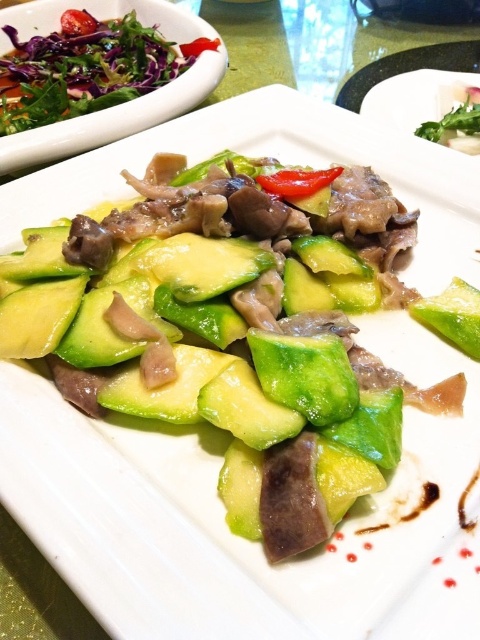
You are a GUI agent. You are given a task and a screenshot of the screen. Output one action in this format:
    pyautogui.click(x=<x>, y=<y>)
    Task: Click on the fresh green salad at upper left
    The height and width of the screenshot is (640, 480).
    Given the screenshot: What is the action you would take?
    pyautogui.click(x=86, y=67)

Based on the photo, is fresh green salad at upper left wider than green leafy salad at upper left?

Correct, the width of fresh green salad at upper left exceeds that of green leafy salad at upper left.

You are a GUI agent. You are given a task and a screenshot of the screen. Output one action in this format:
    pyautogui.click(x=<x>, y=<y>)
    Task: Click on the fresh green salad at upper left
    The height and width of the screenshot is (640, 480).
    Given the screenshot: What is the action you would take?
    [86, 67]